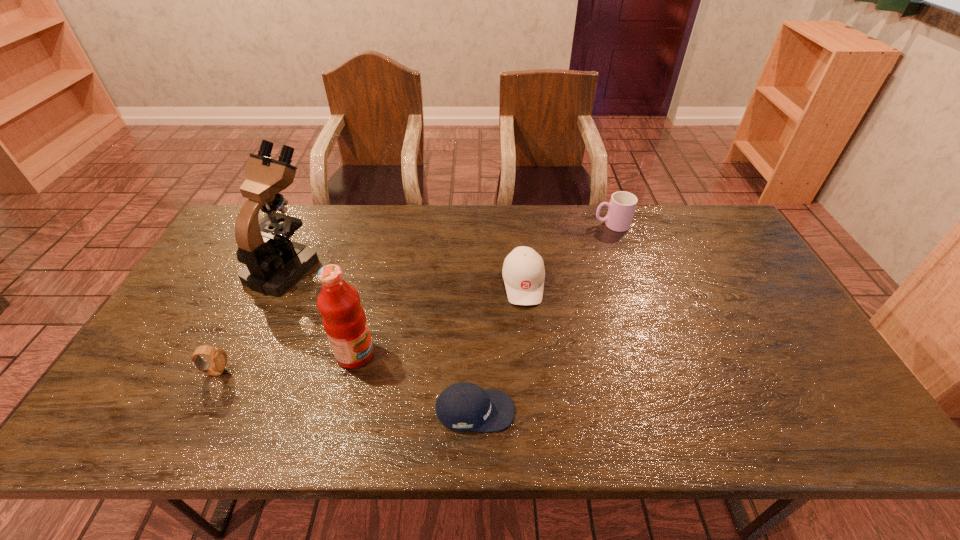
At what (x,y) coordinates should I click in order to perform the action: click on microscope. Please return your answer as a coordinate pair (x, y). This screenshot has width=960, height=540. Looking at the image, I should click on (274, 263).

Identify the location of fruit juice. (344, 320).

Where is `the fourth object from right to left`? This screenshot has width=960, height=540. the fourth object from right to left is located at coordinates (344, 320).

The height and width of the screenshot is (540, 960). I want to click on the farthest object, so coord(621,208).

You are a GUI agent. You are given a task and a screenshot of the screen. Output one action in this format:
    pyautogui.click(x=<x>, y=<y>)
    Task: Click on the rightmost object
    
    Given the screenshot: What is the action you would take?
    pyautogui.click(x=621, y=208)

What are the coordinates of `the farther baseball cap` in the screenshot? It's located at (523, 272).

In order to click on watch in this screenshot , I will do `click(218, 357)`.

At what (x,y) coordinates should I click in order to perform the action: click on the nearer baseball cap. Please return your answer as a coordinate pair (x, y). Looking at the image, I should click on (463, 406).

What are the coordinates of `the shortest object` in the screenshot? It's located at (463, 406).

Locate an element on the screen. The width and height of the screenshot is (960, 540). vacant area situated on the right of the microscope is located at coordinates (338, 266).